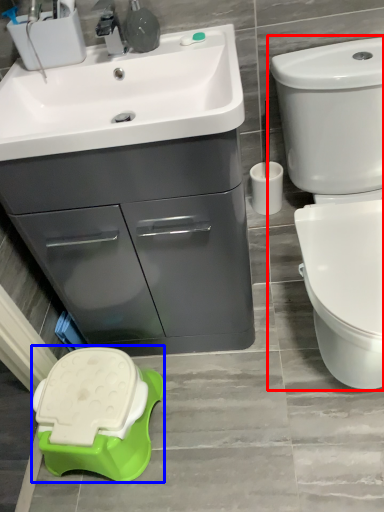
Question: Which of the following is the closest to the observer, toilet (highlighted by a red box) or porcelain (highlighted by a blue box)?

Choices:
 (A) toilet
 (B) porcelain

Answer: (A)